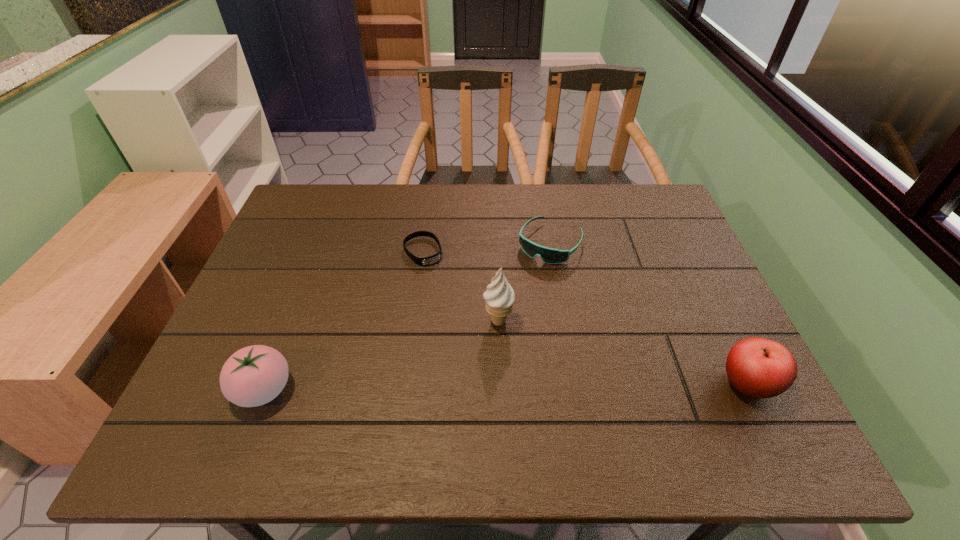
Find the location of a particular element. The height and width of the screenshot is (540, 960). empty location between the fourth object from right to left and the tallest object is located at coordinates (460, 286).

The width and height of the screenshot is (960, 540). In order to click on free space between the tomato and the second shortest object in this screenshot , I will do `click(407, 316)`.

Image resolution: width=960 pixels, height=540 pixels. Find the location of `empty location between the rightmost object and the wristband`. empty location between the rightmost object and the wristband is located at coordinates (585, 318).

Identify the location of object that can be found as the fourth closest to the rightmost object. (253, 376).

Identify which object is the fourth closest to the leftmost object. Please provide its 2D coordinates. Your answer should be formatted as a tuple, i.e. [(x, y)], where the tuple contains the x and y coordinates of a point satisfying the conditions above.

[(760, 368)]

Find the location of `vacant point that satisfies the following two spatial constraints: 1. on the front side of the wristband; 2. on the right side of the apple`. vacant point that satisfies the following two spatial constraints: 1. on the front side of the wristband; 2. on the right side of the apple is located at coordinates (404, 384).